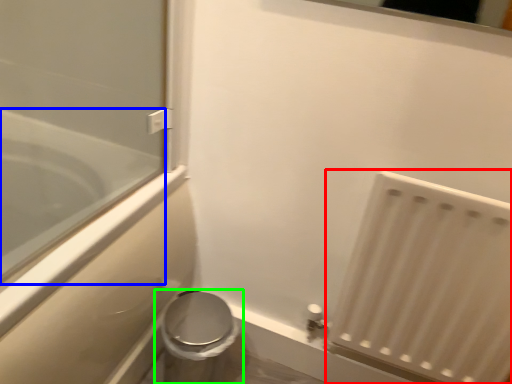
Question: Which is farther away from radiator (highlighted by a red box)? bathtub (highlighted by a blue box) or toilet (highlighted by a green box)?

Choices:
 (A) bathtub
 (B) toilet

Answer: (A)